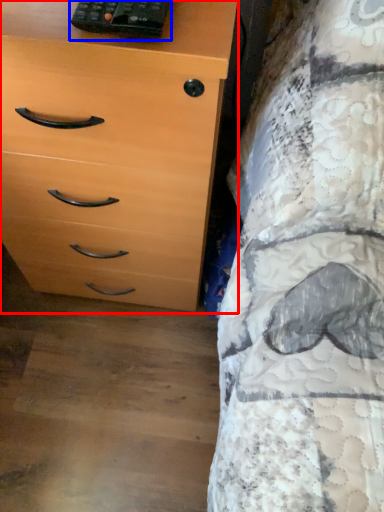
Question: Which object appears farthest to the camera in this image, chest of drawers (highlighted by a red box) or control (highlighted by a blue box)?

Choices:
 (A) chest of drawers
 (B) control

Answer: (B)